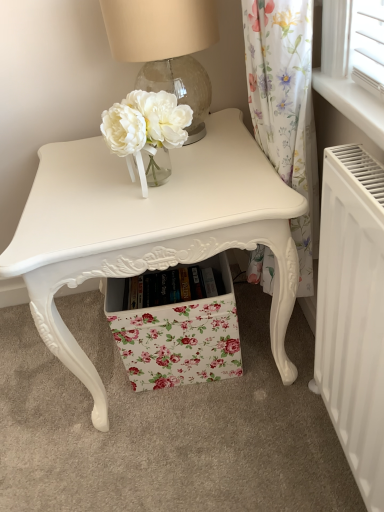
Image resolution: width=384 pixels, height=512 pixels. What are the coordinates of `empty space that is in between floral fabric drawer at center and white matte radiator at lower right` in the screenshot? It's located at (257, 408).